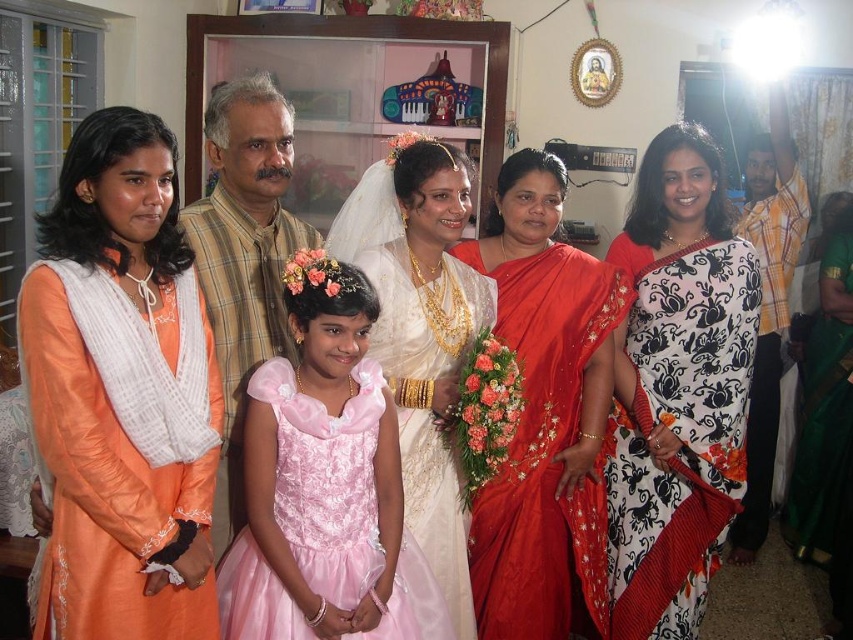
You are a photographer at a family gathering. You need to capture a photo where both the orange silk kurta at left and the shiny red saree at center are clearly visible. Since you want to ensure both are in focus, which object should you focus on first considering their positions?

Since the orange silk kurta at left is closer to the viewer than the shiny red saree at center, you should focus on the orange silk kurta at left first to ensure both are in focus.

You are a photographer standing in the room where the family gathering is taking place. You want to take a photo of the white satin dress at center without moving any objects. Considering your current position, can you fit the entire dress into your camera frame if your camera has a maximum viewing range of 2 meters?

The distance between you and the white satin dress at center is 1.99 meters, which is within the camera frame range of 2 meters. Therefore, you can capture the entire dress in your photo.